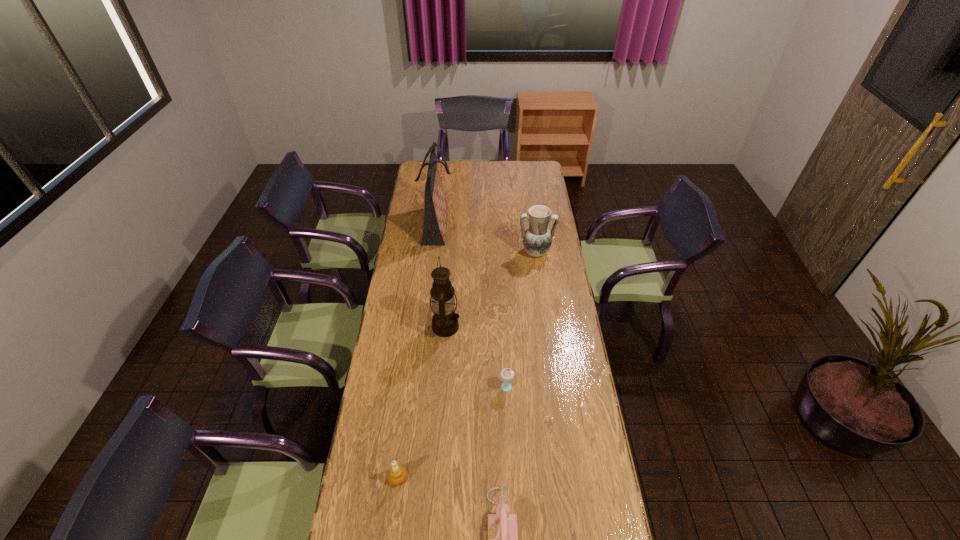
In the image, there is a desktop. Identify the location of vacant space at the far left corner. The width and height of the screenshot is (960, 540). (425, 173).

Locate an element on the screen. This screenshot has height=540, width=960. vacant space at the far right corner is located at coordinates (540, 172).

Find the location of a particular element. This screenshot has width=960, height=540. vacant space that is in between the rightmost object and the shopping bag is located at coordinates (486, 239).

The height and width of the screenshot is (540, 960). I want to click on free space that is in between the candle_holder and the rightmost object, so click(467, 365).

What are the coordinates of `free space between the candle_holder and the milkshake` in the screenshot? It's located at (452, 433).

At what (x,y) coordinates should I click in order to perform the action: click on the third closest object relative to the pottery. Please return your answer as a coordinate pair (x, y). The height and width of the screenshot is (540, 960). Looking at the image, I should click on (507, 374).

Image resolution: width=960 pixels, height=540 pixels. Identify the location of the fourth closest object to the milkshake. (537, 239).

Identify the location of vacant space that satisfies the following two spatial constraints: 1. on either side of the fourth shortest object; 2. on the straw side of the fourth farthest object. (554, 389).

I want to click on vacant point that satisfies the following two spatial constraints: 1. on either side of the third tallest object; 2. on the straw side of the third nearest object, so click(554, 389).

At what (x,y) coordinates should I click in order to perform the action: click on vacant space that satisfies the following two spatial constraints: 1. on either side of the rightmost object; 2. on the straw side of the fourth farthest object. Please return your answer as a coordinate pair (x, y). The width and height of the screenshot is (960, 540). Looking at the image, I should click on (554, 389).